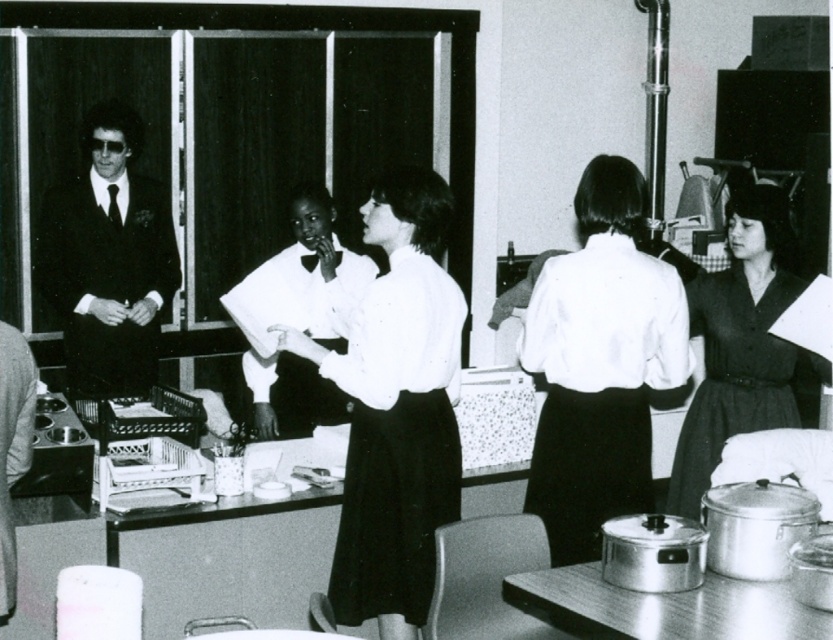
You are standing at the center of the scene and want to locate the matte black dress at right. Based on the coordinates provided, in which direction should you look to find it?

The matte black dress at right is located at coordinates point 0.536 on the x axis and 0.890 on the y axis, so you should look to the right and slightly upwards from your current position at the center to find it.

You are a customer in this professional setting and need to find both the matte black dress at right and the smooth leather jacket at left. According to the scene, which one is positioned higher up?

The matte black dress at right is located above the smooth leather jacket at left, so it is positioned higher up.